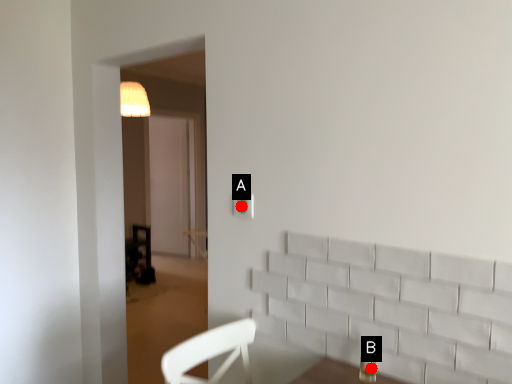
Question: Two points are circled on the image, labeled by A and B beside each circle. Which point is further to the camera?

Choices:
 (A) A is further
 (B) B is further

Answer: (A)